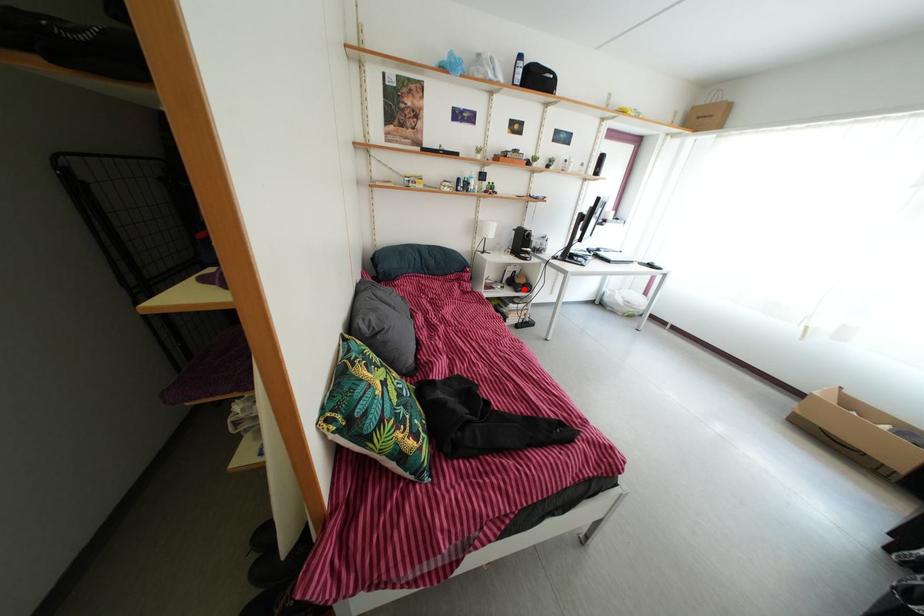
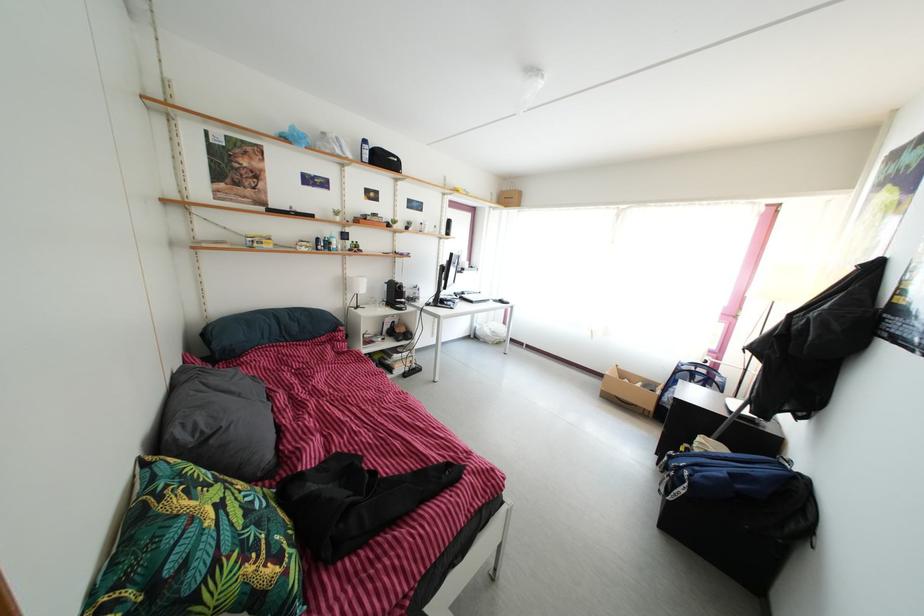
Question: I am providing you with two images of the same scene from different viewpoints. Image1 has a red point marked. In image2, the corresponding 3D location appears at what relative position? Reply with the corresponding letter.

Choices:
 (A) Closer
 (B) Farther

Answer: (B)